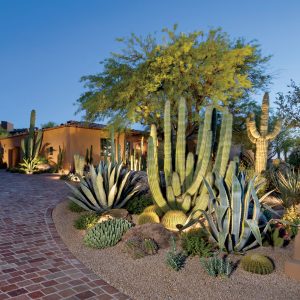
Find the location of a particular element. Image resolution: width=300 pixels, height=300 pixels. small round cactus bottom right is located at coordinates (259, 263).